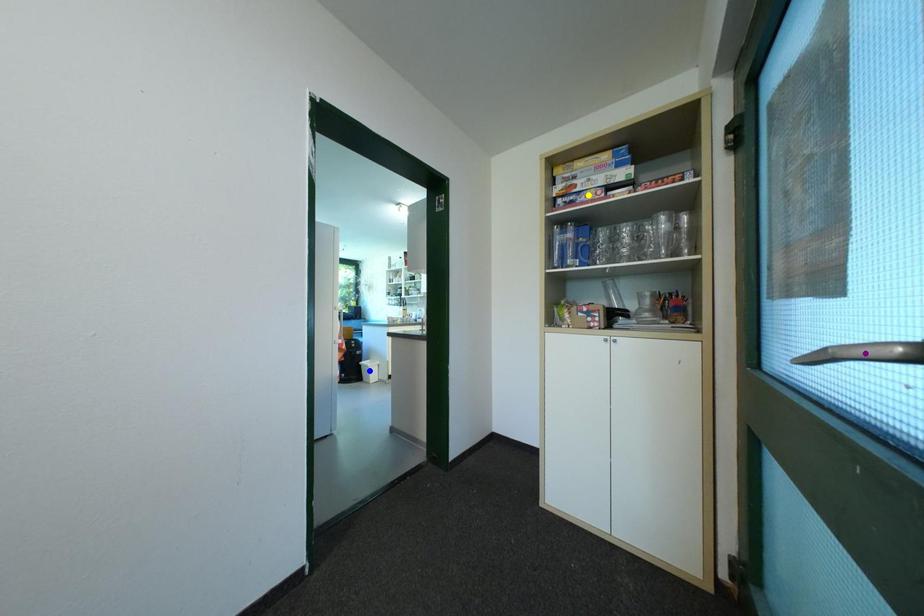
Order these from nearest to farthest:
yellow point | purple point | blue point

purple point → yellow point → blue point